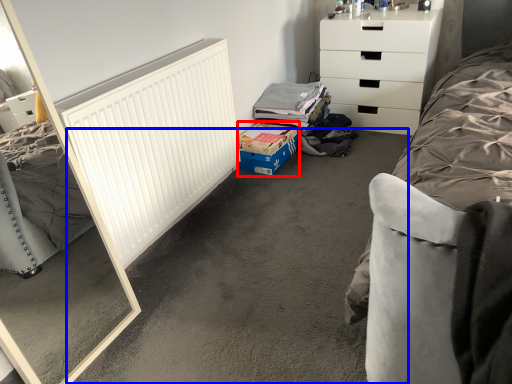
Question: Which of the following is the closest to the observer, cardboard box (highlighted by a red box) or concrete (highlighted by a blue box)?

Choices:
 (A) cardboard box
 (B) concrete

Answer: (B)